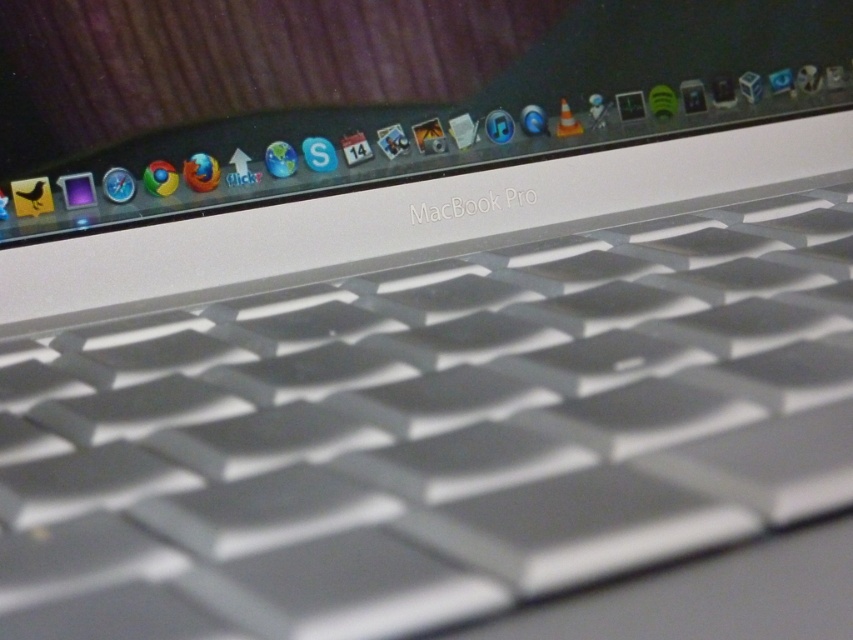
Question: Is satin silver keyboard at center positioned at the back of satin silver macbook pro at upper center?

Choices:
 (A) yes
 (B) no

Answer: (B)

Question: Is satin silver keyboard at center positioned in front of satin silver macbook pro at upper center?

Choices:
 (A) no
 (B) yes

Answer: (B)

Question: Among these objects, which one is nearest to the camera?

Choices:
 (A) satin silver keyboard at center
 (B) satin silver macbook pro at upper center

Answer: (A)

Question: Is the position of satin silver keyboard at center less distant than that of satin silver macbook pro at upper center?

Choices:
 (A) yes
 (B) no

Answer: (A)